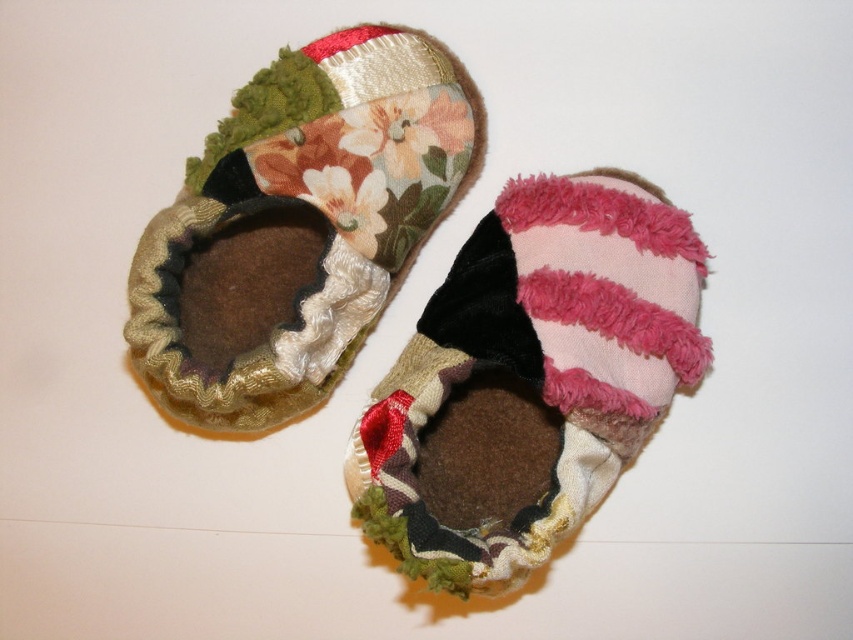
Question: Can you confirm if pink fuzzy slipper at center is wider than floral fabric bootie at center?

Choices:
 (A) yes
 (B) no

Answer: (A)

Question: Which of the following is the farthest from the observer?

Choices:
 (A) (676, 253)
 (B) (152, 310)

Answer: (B)

Question: Which point is closer to the camera taking this photo?

Choices:
 (A) (544, 278)
 (B) (402, 147)

Answer: (A)

Question: Which point is farther to the camera?

Choices:
 (A) floral fabric bootie at center
 (B) pink fuzzy slipper at center

Answer: (A)

Question: Is pink fuzzy slipper at center smaller than floral fabric bootie at center?

Choices:
 (A) no
 (B) yes

Answer: (A)

Question: Observing the image, what is the correct spatial positioning of pink fuzzy slipper at center in reference to floral fabric bootie at center?

Choices:
 (A) right
 (B) left

Answer: (A)